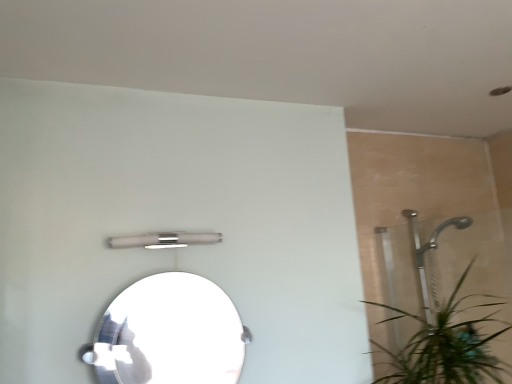
Question: Is clear glass mirror at center wider or thinner than satin nickel light fixture at upper center?

Choices:
 (A) wide
 (B) thin

Answer: (A)

Question: From a real-world perspective, is clear glass mirror at center positioned above or below satin nickel light fixture at upper center?

Choices:
 (A) below
 (B) above

Answer: (A)

Question: Is clear glass mirror at center taller or shorter than satin nickel light fixture at upper center?

Choices:
 (A) short
 (B) tall

Answer: (B)

Question: From the image's perspective, is satin nickel light fixture at upper center positioned above or below clear glass mirror at center?

Choices:
 (A) below
 (B) above

Answer: (B)

Question: Based on their sizes in the image, would you say satin nickel light fixture at upper center is bigger or smaller than clear glass mirror at center?

Choices:
 (A) big
 (B) small

Answer: (B)

Question: Is satin nickel light fixture at upper center wider or thinner than clear glass mirror at center?

Choices:
 (A) thin
 (B) wide

Answer: (A)

Question: Is point (116, 246) closer or farther from the camera than point (162, 334)?

Choices:
 (A) closer
 (B) farther

Answer: (B)